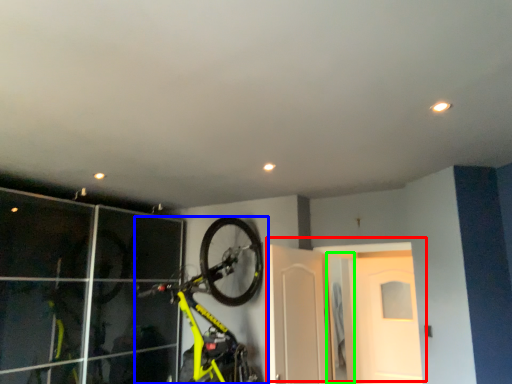
Question: Which is nearer to the door (highlighted by a red box)? bicycle (highlighted by a blue box) or door (highlighted by a green box).

Choices:
 (A) bicycle
 (B) door

Answer: (A)